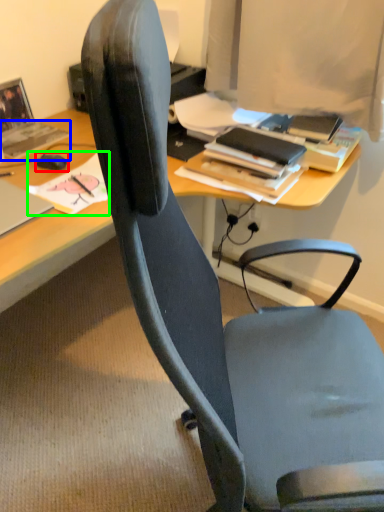
Question: Based on their relative distances, which object is farther from mouse (highlighted by a red box)? Choose from book (highlighted by a blue box) and book (highlighted by a green box).

Choices:
 (A) book
 (B) book

Answer: (A)